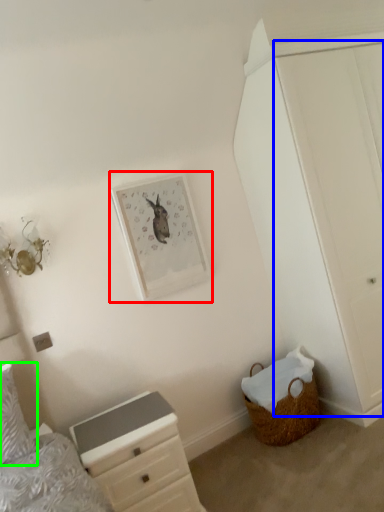
Question: Which is nearer to the picture frame (highlighted by a red box)? door (highlighted by a blue box) or pillow (highlighted by a green box).

Choices:
 (A) door
 (B) pillow

Answer: (A)